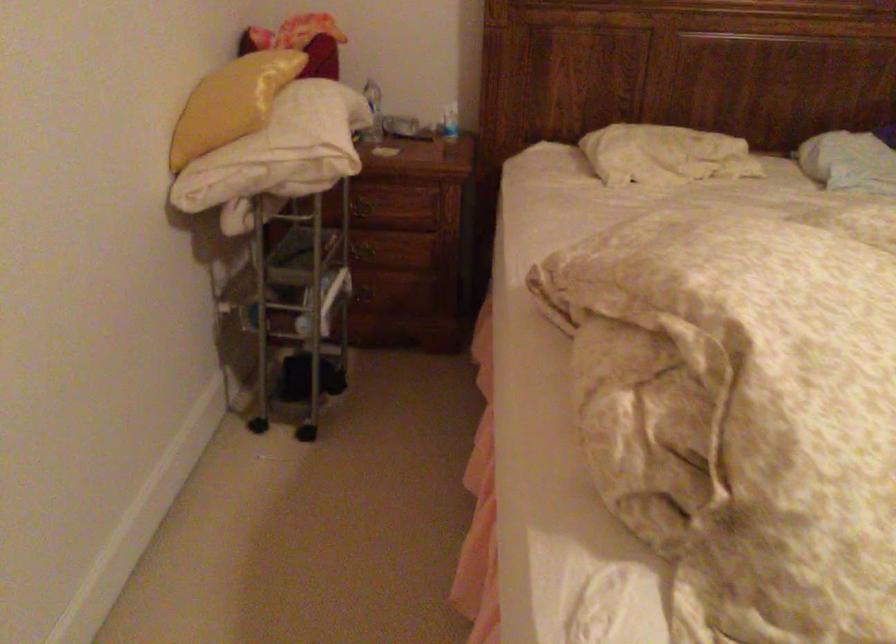
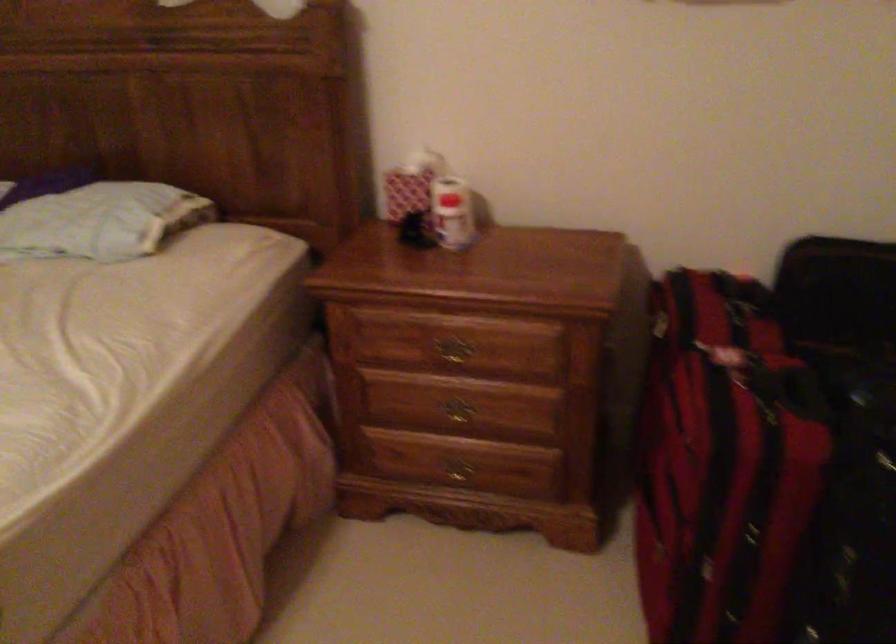
Question: The images are taken continuously from a first-person perspective. In which direction are you moving?

Choices:
 (A) Left
 (B) Right
 (C) Forward
 (D) Backward

Answer: (B)